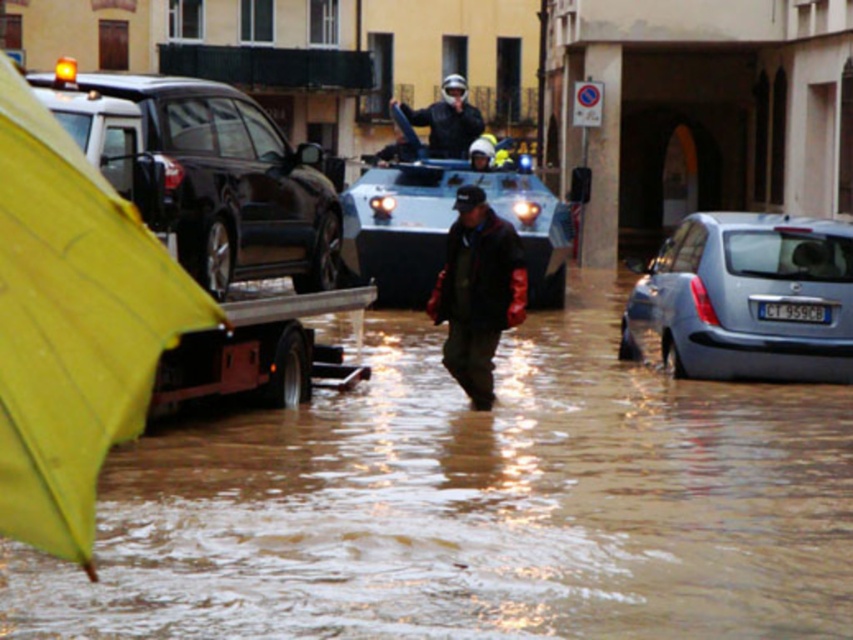
Looking at this image, which is more to the right, yellow fabric umbrella at left or shiny black suv at left?

yellow fabric umbrella at left is more to the right.

Is yellow fabric umbrella at left thinner than shiny black suv at left?

Indeed, yellow fabric umbrella at left has a lesser width compared to shiny black suv at left.

The width and height of the screenshot is (853, 640). I want to click on yellow fabric umbrella at left, so click(73, 324).

Which of these two, yellow fabric umbrella at left or matte black helmet at center, stands taller?

With more height is matte black helmet at center.

Who is more forward, (54, 380) or (440, 120)?

Point (54, 380)

This screenshot has height=640, width=853. I want to click on yellow fabric umbrella at left, so click(x=73, y=324).

Is silver metallic car at lower right positioned behind dark brown leather jacket at center?

Yes, silver metallic car at lower right is further from the viewer.

Can you confirm if silver metallic car at lower right is bigger than dark brown leather jacket at center?

Indeed, silver metallic car at lower right has a larger size compared to dark brown leather jacket at center.

Where is `silver metallic car at lower right`? The height and width of the screenshot is (640, 853). silver metallic car at lower right is located at coordinates (747, 298).

You are a GUI agent. You are given a task and a screenshot of the screen. Output one action in this format:
    pyautogui.click(x=<x>, y=<y>)
    Task: Click on the silver metallic car at lower right
    This screenshot has height=640, width=853.
    Given the screenshot: What is the action you would take?
    pyautogui.click(x=747, y=298)